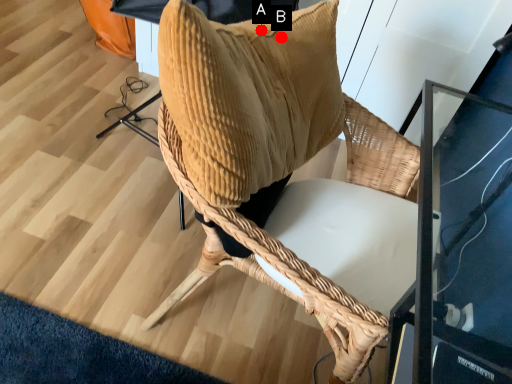
Question: Two points are circled on the image, labeled by A and B beside each circle. Which point is closer to the camera taking this photo?

Choices:
 (A) A is closer
 (B) B is closer

Answer: (A)